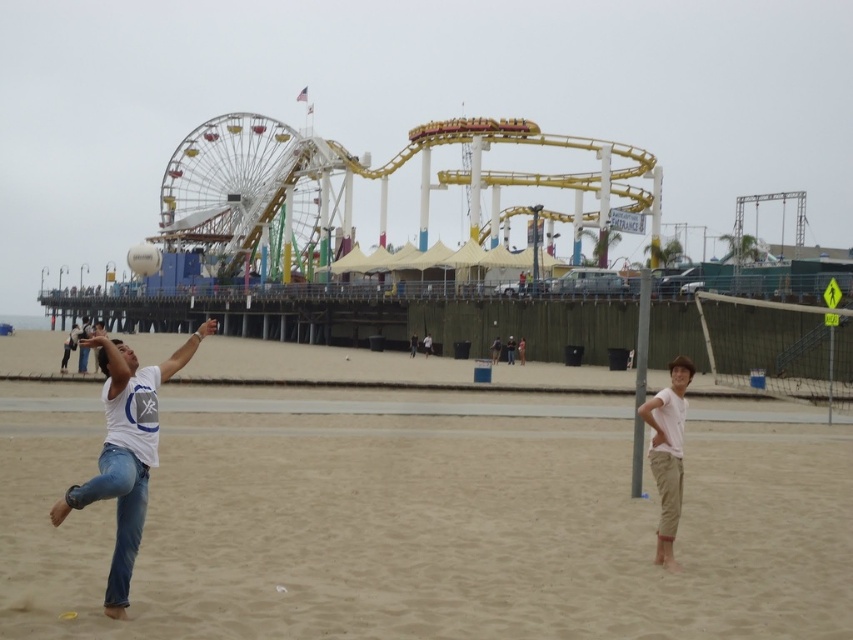
You are a photographer trying to capture the Ferris wheel in the background while also including the person wearing the white cotton shirt at lower right in your shot. Based on their position, will the shirt be in the foreground or background of the photo?

The white cotton shirt at lower right is located at point (666, 451), which places it in the foreground of the image, so the shirt will be in the foreground of the photo.